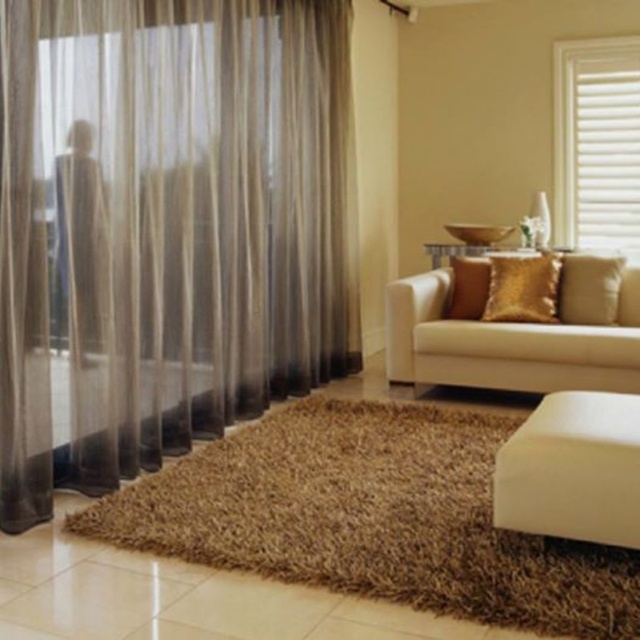
Which of these two, sheer beige curtain at left or beige fabric couch at center, stands shorter?

beige fabric couch at center is shorter.

Does sheer beige curtain at left appear over beige fabric couch at center?

Yes, sheer beige curtain at left is above beige fabric couch at center.

Is point (289, 100) closer to camera compared to point (589, 285)?

That is False.

The width and height of the screenshot is (640, 640). In order to click on sheer beige curtain at left in this screenshot , I will do `click(166, 228)`.

Between point (436, 339) and point (461, 285), which one is positioned in front?

Point (436, 339)

Between beige fabric couch at center and gold textured pillow at center, which one appears on the right side from the viewer's perspective?

From the viewer's perspective, beige fabric couch at center appears more on the right side.

Based on the photo, who is more forward, (550, 326) or (451, 316)?

Point (550, 326) is in front.

Locate an element on the screen. The width and height of the screenshot is (640, 640). beige fabric couch at center is located at coordinates (520, 333).

Which is in front, point (193, 349) or point (480, 307)?

Point (193, 349) is in front.

Does sheer beige curtain at left come behind gold textured pillow at center?

No, sheer beige curtain at left is in front of gold textured pillow at center.

Between point (209, 186) and point (472, 262), which one is positioned behind?

The point (472, 262) is more distant.

The image size is (640, 640). In order to click on sheer beige curtain at left in this screenshot , I will do `click(166, 228)`.